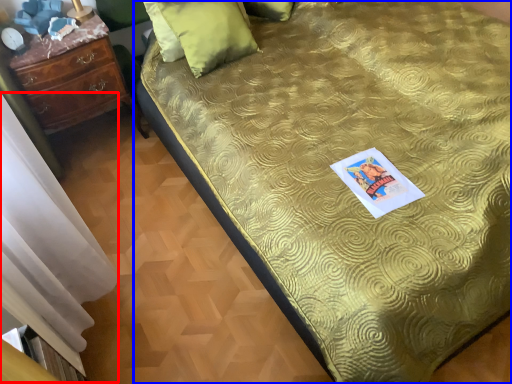
Question: Which point is closer to the camera, curtain (highlighted by a red box) or bed (highlighted by a blue box)?

Choices:
 (A) curtain
 (B) bed

Answer: (A)